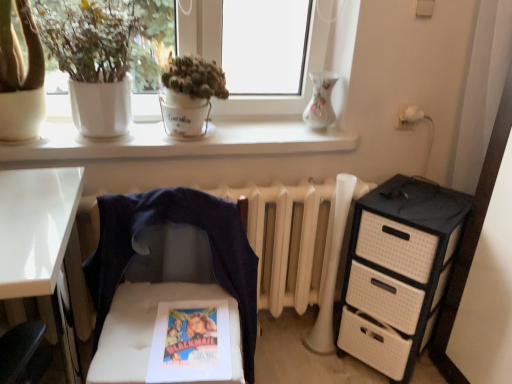
Where is `white matte pot at upper left, marked as the second houseplant in a right-to-left arrangement`? The image size is (512, 384). white matte pot at upper left, marked as the second houseplant in a right-to-left arrangement is located at coordinates (102, 55).

Locate an element on the screen. white tufted chair at center is located at coordinates (165, 275).

Describe the element at coordinates (165, 275) in the screenshot. I see `white tufted chair at center` at that location.

What is the approximate width of green matte pot at upper center, which is the 1th houseplant from right to left?

green matte pot at upper center, which is the 1th houseplant from right to left, is 8.00 inches in width.

What do you see at coordinates (191, 342) in the screenshot?
I see `matte paper comic book at center` at bounding box center [191, 342].

The height and width of the screenshot is (384, 512). Find the location of `white matte window sill at upper center`. white matte window sill at upper center is located at coordinates (178, 142).

Describe the element at coordinates (178, 142) in the screenshot. I see `white matte window sill at upper center` at that location.

I want to click on black textured chest of drawers at right, so click(398, 271).

From the image's perspective, is white matte pot at upper left, marked as the second houseplant in a right-to-left arrangement, positioned above or below porcelain vase at upper center?

white matte pot at upper left, marked as the second houseplant in a right-to-left arrangement, is above porcelain vase at upper center.

At what (x,y) coordinates should I click in order to perform the action: click on vase on the right of white matte pot at upper left, the first houseplant when ordered from left to right. Please return your answer as a coordinate pair (x, y). The width and height of the screenshot is (512, 384). Looking at the image, I should click on (321, 101).

From a real-world perspective, which is physically above, white matte pot at upper left, the first houseplant when ordered from left to right, or white matte window sill at upper center?

white matte pot at upper left, the first houseplant when ordered from left to right, is physically above.

Is white matte pot at upper left, marked as the second houseplant in a right-to-left arrangement, facing towards white matte window sill at upper center?

No, white matte pot at upper left, marked as the second houseplant in a right-to-left arrangement, does not turn towards white matte window sill at upper center.

From the image's perspective, starting from the white matte window sill at upper center, which houseplant is the 2nd one above? Please provide its 2D coordinates.

[(102, 55)]

Are white matte pot at upper left, the first houseplant when ordered from left to right, and white matte window sill at upper center making contact?

white matte pot at upper left, the first houseplant when ordered from left to right, and white matte window sill at upper center are not in contact.

In the scene shown: Does porcelain vase at upper center have a greater height compared to white matte window sill at upper center?

Yes, porcelain vase at upper center is taller than white matte window sill at upper center.

Is porcelain vase at upper center smaller than white matte window sill at upper center?

Yes, porcelain vase at upper center is smaller than white matte window sill at upper center.

How distant is porcelain vase at upper center from white matte window sill at upper center?

porcelain vase at upper center and white matte window sill at upper center are 38.19 centimeters apart from each other.

The height and width of the screenshot is (384, 512). I want to click on window sill located on the left of porcelain vase at upper center, so [x=178, y=142].

Can you confirm if black textured chest of drawers at right is taller than matte paper comic book at center?

Correct, black textured chest of drawers at right is much taller as matte paper comic book at center.

Can you tell me how much black textured chest of drawers at right and matte paper comic book at center differ in facing direction?

44.8 degrees separate the facing orientations of black textured chest of drawers at right and matte paper comic book at center.

From a real-world perspective, between black textured chest of drawers at right and matte paper comic book at center, who is vertically higher?

matte paper comic book at center.

Is point (362, 258) closer or farther from the camera than point (206, 331)?

Point (362, 258) is farther from the camera than point (206, 331).

Does white matte window sill at upper center lie behind green matte pot at upper center, which is the 1th houseplant from right to left?

Yes.

From a real-world perspective, which object rests below the other?

white matte window sill at upper center is physically lower.

From the image's perspective, between white matte window sill at upper center and green matte pot at upper center, which is the 1th houseplant from right to left, who is located below?

white matte window sill at upper center is shown below in the image.

Is white matte window sill at upper center oriented away from green matte pot at upper center, which is the 1th houseplant from right to left?

That's not correct — white matte window sill at upper center is not looking away from green matte pot at upper center, which is the 1th houseplant from right to left.

From a real-world perspective, is white matte window sill at upper center positioned over black textured chest of drawers at right based on gravity?

Yes, from a real-world perspective, white matte window sill at upper center is over black textured chest of drawers at right

Which of these two, white matte window sill at upper center or black textured chest of drawers at right, stands shorter?

Standing shorter between the two is white matte window sill at upper center.

Which is correct: white matte window sill at upper center is inside black textured chest of drawers at right, or outside of it?

white matte window sill at upper center is not inside black textured chest of drawers at right, it's outside.

Can you confirm if matte paper comic book at center is shorter than porcelain vase at upper center?

Correct, matte paper comic book at center is not as tall as porcelain vase at upper center.

Is matte paper comic book at center next to porcelain vase at upper center?

No, matte paper comic book at center is not beside porcelain vase at upper center.

Who is smaller, matte paper comic book at center or porcelain vase at upper center?

With smaller size is matte paper comic book at center.

From the image's perspective, is matte paper comic book at center located above or below porcelain vase at upper center?

From the image's perspective, matte paper comic book at center appears below porcelain vase at upper center.

Find the location of a particular element. vase behind the white matte pot at upper left, the first houseplant when ordered from left to right is located at coordinates (321, 101).

This screenshot has height=384, width=512. Identify the location of houseplant on the left of white matte window sill at upper center. (102, 55).

Looking at the image, which one is located closer to matte paper comic book at center, black textured chest of drawers at right or white tufted chair at center?

white tufted chair at center is closer to matte paper comic book at center.

Which object lies further to the anchor point white tufted chair at center, porcelain vase at upper center or matte paper comic book at center?

The object further to white tufted chair at center is porcelain vase at upper center.

In the scene shown: Which object lies nearer to the anchor point white tufted chair at center, matte paper comic book at center or white matte pot at upper left, the first houseplant when ordered from left to right?

The object closer to white tufted chair at center is matte paper comic book at center.

Looking at the image, which one is located closer to white matte window sill at upper center, green matte pot at upper center, the second houseplant from the left, or matte paper comic book at center?

green matte pot at upper center, the second houseplant from the left, is positioned closer to the anchor white matte window sill at upper center.

Considering their positions, is black textured chest of drawers at right positioned further to white matte window sill at upper center than green matte pot at upper center, the second houseplant from the left?

Based on the image, black textured chest of drawers at right appears to be further to white matte window sill at upper center.

When comparing their distances from matte paper comic book at center, does white tufted chair at center or black textured chest of drawers at right seem closer?

white tufted chair at center is closer to matte paper comic book at center.

Considering their positions, is green matte pot at upper center, which is the 1th houseplant from right to left, positioned further to porcelain vase at upper center than white matte pot at upper left, the first houseplant when ordered from left to right?

Based on the image, white matte pot at upper left, the first houseplant when ordered from left to right, appears to be further to porcelain vase at upper center.

From the picture: Based on their spatial positions, is white matte pot at upper left, marked as the second houseplant in a right-to-left arrangement, or white matte window sill at upper center closer to green matte pot at upper center, which is the 1th houseplant from right to left?

The object closer to green matte pot at upper center, which is the 1th houseplant from right to left, is white matte window sill at upper center.

Locate an element on the screen. The height and width of the screenshot is (384, 512). vase between white matte pot at upper left, the first houseplant when ordered from left to right, and matte paper comic book at center, in the vertical direction is located at coordinates click(321, 101).

Locate an element on the screen. The height and width of the screenshot is (384, 512). houseplant between porcelain vase at upper center and white tufted chair at center in the vertical direction is located at coordinates (190, 95).

Where is `houseplant located between white matte pot at upper left, the first houseplant when ordered from left to right, and porcelain vase at upper center in the left-right direction`? The image size is (512, 384). houseplant located between white matte pot at upper left, the first houseplant when ordered from left to right, and porcelain vase at upper center in the left-right direction is located at coordinates (190, 95).

Identify the location of comic book located between white matte window sill at upper center and black textured chest of drawers at right in the left-right direction. This screenshot has width=512, height=384. (191, 342).